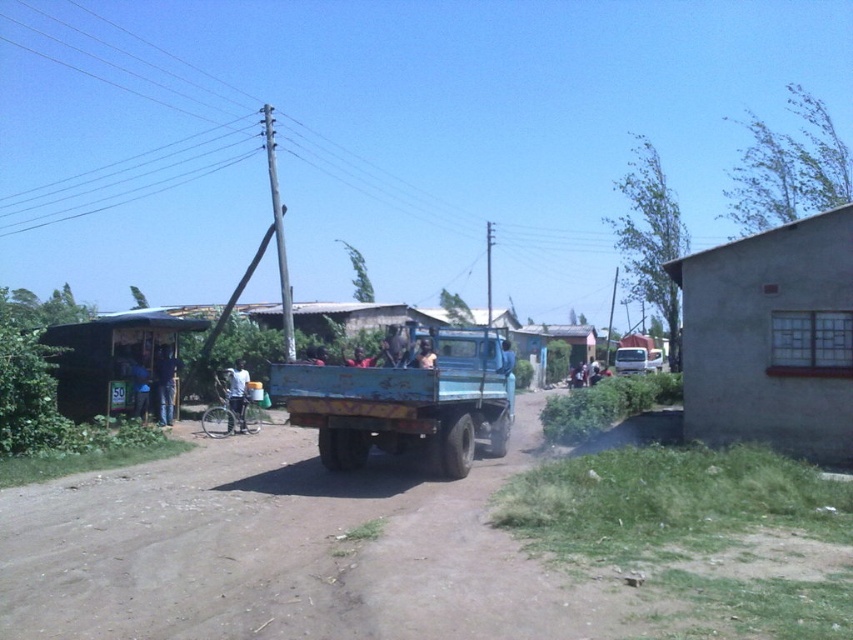
You are a delivery person standing at the makeshift shelter with the sign 50. You need to place a package on the white matte bicycle at center and then pick up a jacket from the light brown leather jacket at center. Can you do both tasks without moving more than 7 meters from the shelter?

The white matte bicycle at center and light brown leather jacket at center are 6.84 meters apart. Since the total distance required to reach both objects is within the 7 meter limit, yes, you can complete both tasks without exceeding the distance.

You are standing at the wooden hut at left and want to hand a map to the person wearing the light brown leather jacket at center. Can you directly hand it to them without moving from your current position?

The wooden hut at left is further to the viewer than the light brown leather jacket at center, so the person wearing the light brown leather jacket at center is closer to you. You can directly hand the map to them without moving from your current position.